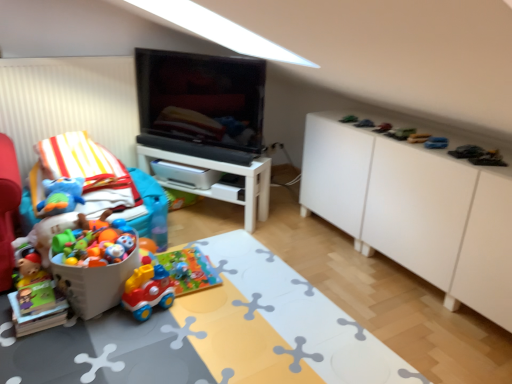
Question: Is point (440, 144) positioned closer to the camera than point (401, 134)?

Choices:
 (A) farther
 (B) closer

Answer: (B)

Question: Looking at the image, does blue rubber toy at upper right, which is the third toy from right to left, seem bigger or smaller compared to green plastic toy car at upper right, which is counted as the 5th toy, starting from the right?

Choices:
 (A) small
 (B) big

Answer: (A)

Question: Which of these objects is positioned closest to the rubber car at upper right, placed as the 7th toy when sorted from right to left?

Choices:
 (A) plastic toy car at upper right, arranged as the eleventh toy when viewed from the left
 (B) white glossy table at center, placed as the 2th table when sorted from front to back
 (C) green plastic toy at upper right, arranged as the 8th toy when viewed from the right
 (D) green plastic toy car at upper right, which is counted as the 5th toy, starting from the right
 (E) metallic silver toy car at upper right, positioned as the sixth toy in left-to-right order

Answer: (E)

Question: Based on their relative distances, which object is farther from the soft plush toy at left, the 11th toy in the right-to-left sequence?

Choices:
 (A) white glossy table at center, the 1th table in the front-to-back sequence
 (B) rubber duck at upper right, the eighth toy when ordered from left to right
 (C) blue rubber toy at upper right, which is the third toy from right to left
 (D) metallic silver toy car at upper right, positioned as the sixth toy in left-to-right order
 (E) white glossy table at center, positioned as the 2th table in bottom-to-top order

Answer: (C)